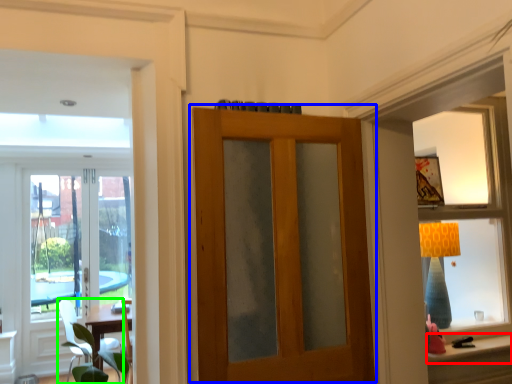
Question: Based on their relative distances, which object is farther from window sill (highlighted by a red box)? Choose from door (highlighted by a blue box) and chair (highlighted by a green box).

Choices:
 (A) door
 (B) chair

Answer: (B)